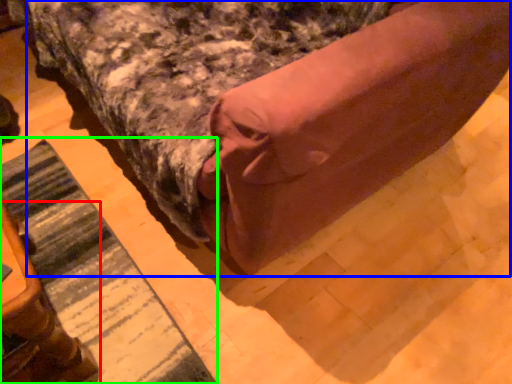
Question: Which is farther away from furniture (highlighted by a red box)? bed (highlighted by a blue box) or mat (highlighted by a green box)?

Choices:
 (A) bed
 (B) mat

Answer: (A)